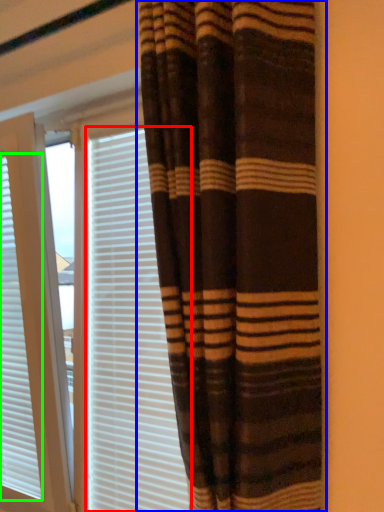
Question: Considering the real-world distances, which object is farthest from blind (highlighted by a red box)? curtain (highlighted by a blue box) or window blind (highlighted by a green box)?

Choices:
 (A) curtain
 (B) window blind

Answer: (A)